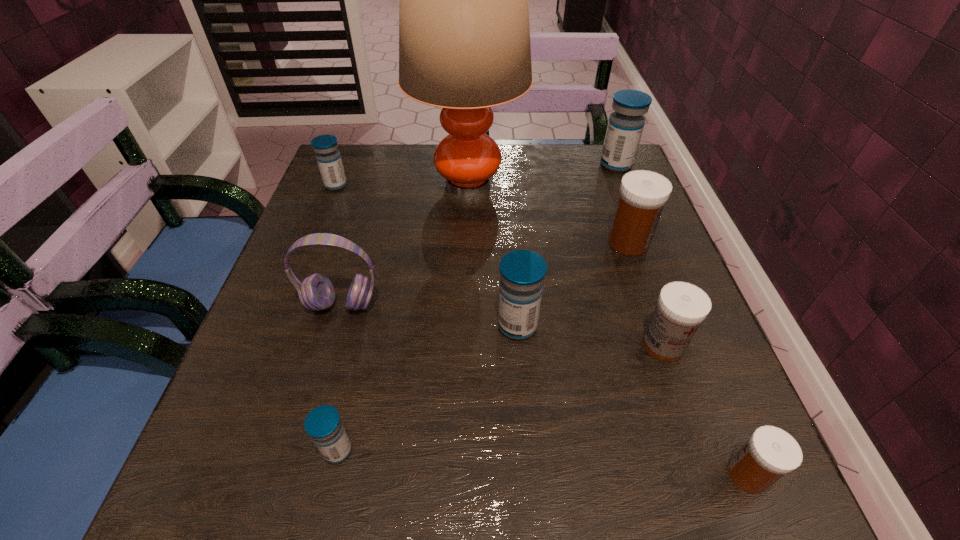
Locate an element on the screen. This screenshot has height=540, width=960. free location located 0.230m on the front of the third nearest blue medicine is located at coordinates (307, 257).

This screenshot has width=960, height=540. What are the coordinates of `free space located on the back of the second farthest white medicine` in the screenshot? It's located at (627, 242).

Where is `vacant space located on the left of the smallest blue medicine`? Image resolution: width=960 pixels, height=540 pixels. vacant space located on the left of the smallest blue medicine is located at coordinates (225, 450).

Locate an element on the screen. The width and height of the screenshot is (960, 540). free location located on the left of the smallest white medicine is located at coordinates (444, 475).

Where is `lamp situated at the far edge`? The height and width of the screenshot is (540, 960). lamp situated at the far edge is located at coordinates (464, 37).

You are a GUI agent. You are given a task and a screenshot of the screen. Output one action in this format:
    pyautogui.click(x=<x>, y=<y>)
    Task: Click on the headset situated at the left edge
    The width and height of the screenshot is (960, 540).
    Given the screenshot: What is the action you would take?
    pyautogui.click(x=316, y=292)

Identify the location of medicine that is at the left edge. The image size is (960, 540). (328, 157).

Identify the location of object at the far left corner. The width and height of the screenshot is (960, 540). (328, 157).

Where is `object at the far right corner`? The height and width of the screenshot is (540, 960). object at the far right corner is located at coordinates (625, 126).

Find the location of a particular element. Image resolution: width=960 pixels, height=540 pixels. object that is at the near right corner is located at coordinates (770, 453).